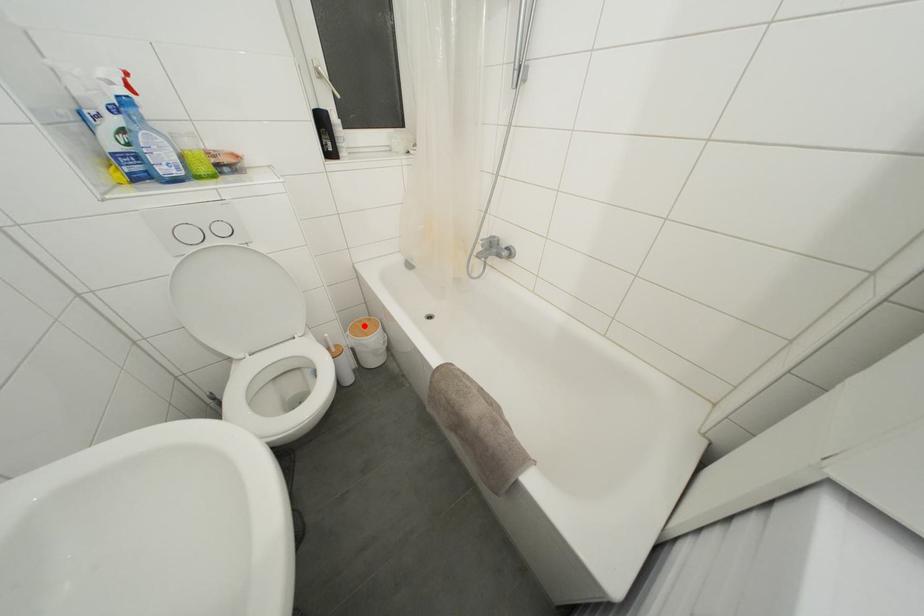
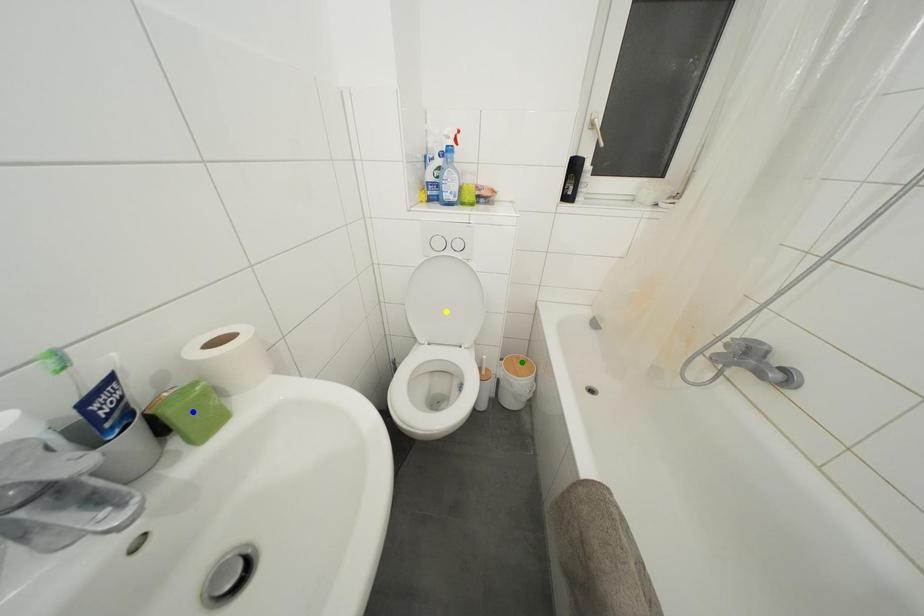
Question: I am providing you with two images of the same scene from different viewpoints. A red point is marked on the first image. You are given multiple points on the second image. Which mark in image 2 goes with the point in image 1?

Choices:
 (A) blue point
 (B) green point
 (C) yellow point

Answer: (B)